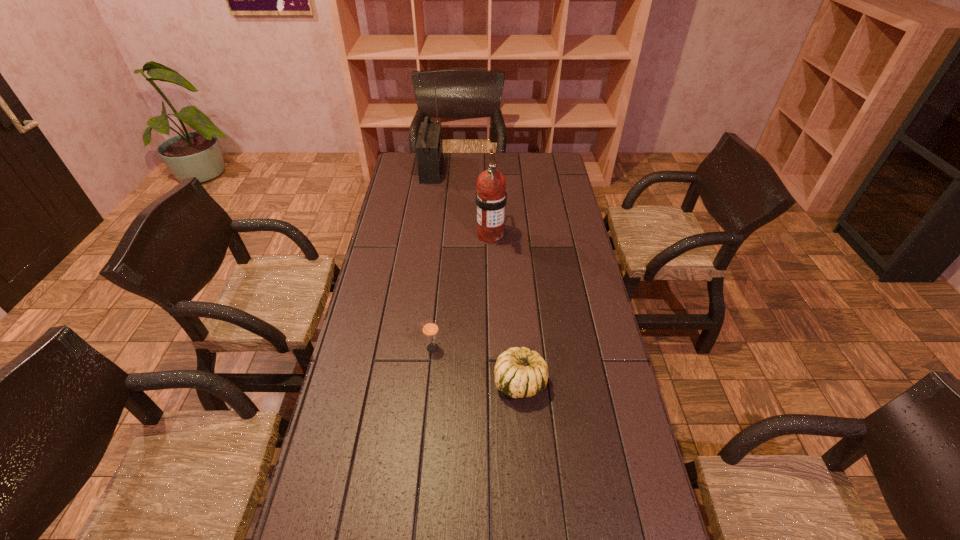
At what (x,y) coordinates should I click in order to perform the action: click on free space between the nearest object and the leftmost object. Please return your answer as a coordinate pair (x, y). Looking at the image, I should click on (476, 276).

Find the location of a particular element. This screenshot has width=960, height=540. unoccupied area between the nearest object and the second farthest object is located at coordinates (505, 309).

Locate an element on the screen. vacant region between the gourd and the second nearest object is located at coordinates (476, 365).

What are the coordinates of `vacant area that lies between the nearest object and the third object from right to left` in the screenshot? It's located at (476, 365).

The image size is (960, 540). What are the coordinates of `vacant point located between the leftmost object and the straw` in the screenshot? It's located at (432, 259).

I want to click on vacant space that is in between the third nearest object and the radio receiver, so click(x=461, y=202).

Where is `vacant space in between the second nearest object and the nearest object`? vacant space in between the second nearest object and the nearest object is located at coordinates (476, 365).

Where is `free spot between the second farthest object and the third object from right to left`? This screenshot has height=540, width=960. free spot between the second farthest object and the third object from right to left is located at coordinates (462, 292).

Select which object is the second closest to the straw. Please provide its 2D coordinates. Your answer should be formatted as a tuple, i.e. [(x, y)], where the tuple contains the x and y coordinates of a point satisfying the conditions above.

[(491, 197)]

At what (x,y) coordinates should I click in order to perform the action: click on object that is the second closest to the straw. Please return your answer as a coordinate pair (x, y). The width and height of the screenshot is (960, 540). Looking at the image, I should click on (491, 197).